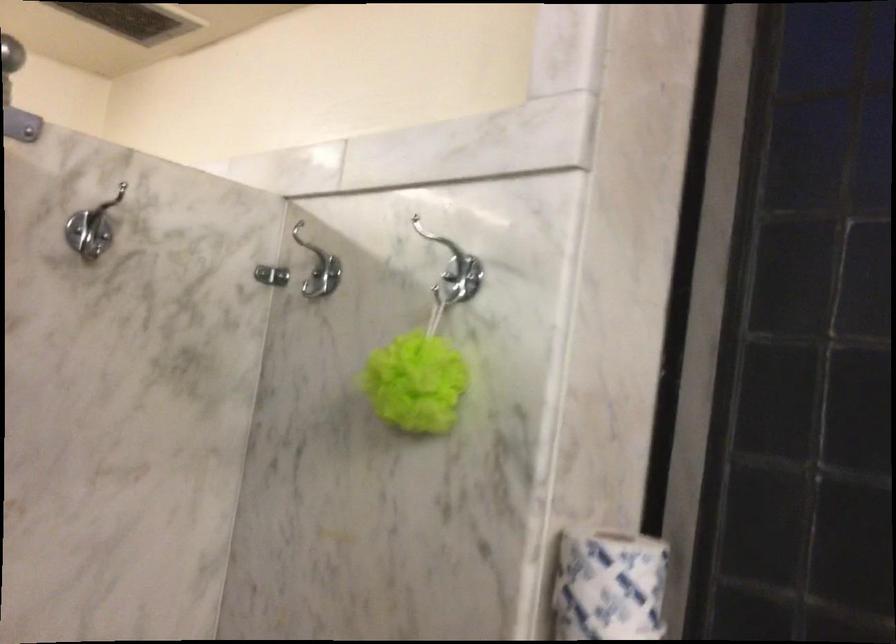
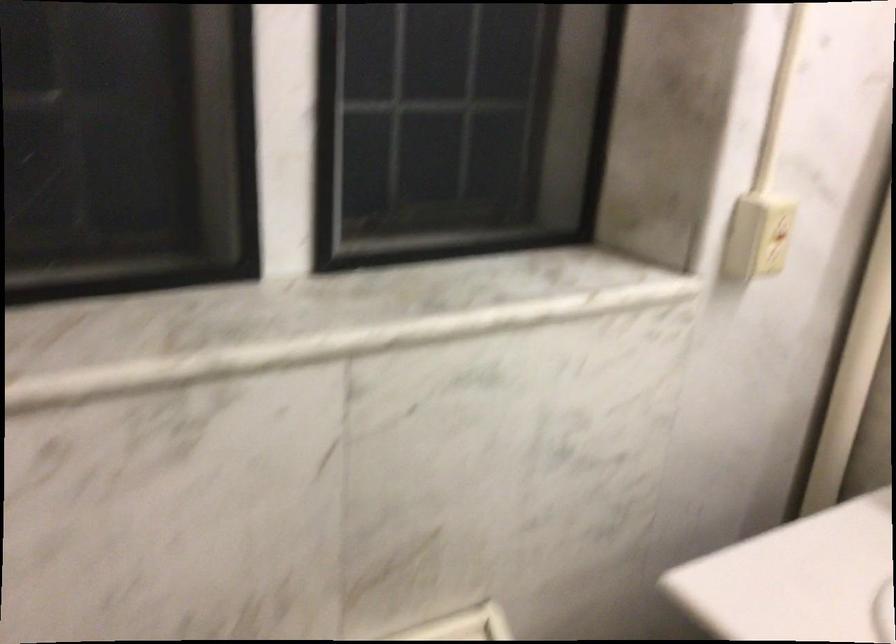
The first image is from the beginning of the video and the second image is from the end. How did the camera likely rotate when shooting the video?

The camera rotated toward right-down.